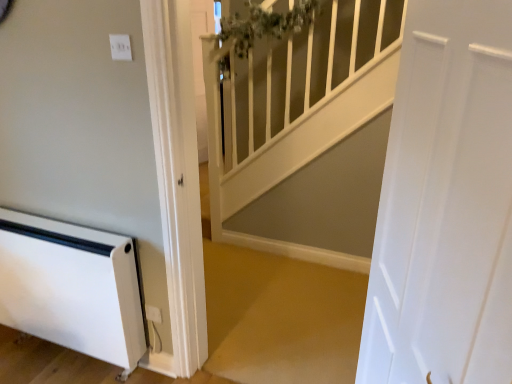
This screenshot has height=384, width=512. What do you see at coordinates (445, 204) in the screenshot? I see `white smooth door at right` at bounding box center [445, 204].

Image resolution: width=512 pixels, height=384 pixels. I want to click on white smooth door at right, so click(x=445, y=204).

The image size is (512, 384). What do you see at coordinates (153, 314) in the screenshot? I see `white plastic electric outlet at lower center` at bounding box center [153, 314].

What are the coordinates of `white smooth door at right` in the screenshot? It's located at (445, 204).

Does point (301, 241) come behind point (398, 350)?

That is True.

What's the angular difference between white glossy banister at upper center and white smooth door at right's facing directions?

The angle between the facing direction of white glossy banister at upper center and the facing direction of white smooth door at right is 74.1 degrees.

Find the location of a particular element. The width and height of the screenshot is (512, 384). door to the right of white glossy banister at upper center is located at coordinates (445, 204).

Which is behind, white glossy banister at upper center or white smooth door at right?

white glossy banister at upper center is further away from the camera.

This screenshot has height=384, width=512. I want to click on stairwell located above the white smooth door at right (from the image's perspective), so pos(306,135).

Consider the image. What's the angular difference between white smooth door at right and white glossy banister at upper center's facing directions?

74.1 degrees.

Can you confirm if white smooth door at right is taller than white glossy banister at upper center?

In fact, white smooth door at right may be shorter than white glossy banister at upper center.

From the image's perspective, relative to white glossy banister at upper center, is white smooth door at right above or below?

Clearly, from the image's perspective, white smooth door at right is below white glossy banister at upper center.

Would you consider white plastic electric outlet at lower center to be distant from white smooth door at right?

Absolutely, white plastic electric outlet at lower center is distant from white smooth door at right.

Is white plastic electric outlet at lower center oriented towards white smooth door at right?

No.

Would you say white plastic electric outlet at lower center is inside or outside white smooth door at right?

white plastic electric outlet at lower center is outside white smooth door at right.

Where is `electric outlet that appears on the right of white plastic heater at lower left`? The width and height of the screenshot is (512, 384). electric outlet that appears on the right of white plastic heater at lower left is located at coordinates (153, 314).

In terms of size, does white plastic heater at lower left appear bigger or smaller than white plastic electric outlet at lower center?

Considering their sizes, white plastic heater at lower left takes up more space than white plastic electric outlet at lower center.

Would you say white plastic heater at lower left is outside white plastic electric outlet at lower center?

white plastic heater at lower left lies outside white plastic electric outlet at lower center's area.

From the image's perspective, which object appears higher, white plastic heater at lower left or white smooth door at right?

white smooth door at right.

Is white plastic heater at lower left shorter than white smooth door at right?

Indeed, white plastic heater at lower left has a lesser height compared to white smooth door at right.

Which object is positioned more to the right, white plastic heater at lower left or white smooth door at right?

Positioned to the right is white smooth door at right.

Which object is closer to the camera taking this photo, white plastic heater at lower left or white smooth door at right?

white smooth door at right is in front.

Is white smooth door at right positioned behind white plastic electric outlet at lower center?

No, it is not.

Considering the relative sizes of white smooth door at right and white plastic electric outlet at lower center in the image provided, is white smooth door at right smaller than white plastic electric outlet at lower center?

No, white smooth door at right is not smaller than white plastic electric outlet at lower center.

You are a GUI agent. You are given a task and a screenshot of the screen. Output one action in this format:
    pyautogui.click(x=<x>, y=<y>)
    Task: Click on the electric outlet on the left of the white smooth door at right
    
    Given the screenshot: What is the action you would take?
    pyautogui.click(x=153, y=314)

Is white smooth door at right facing away from white plastic heater at lower left?

No, white smooth door at right is not facing away from white plastic heater at lower left.

Does point (485, 64) appear closer or farther from the camera than point (82, 349)?

Clearly, point (485, 64) is closer to the camera than point (82, 349).

Between white smooth door at right and white plastic heater at lower left, which one has larger size?

white smooth door at right.

Are white smooth door at right and white plastic heater at lower left beside each other?

No, white smooth door at right is not next to white plastic heater at lower left.

Identify the location of door below the white glossy banister at upper center (from the image's perspective). Image resolution: width=512 pixels, height=384 pixels. (445, 204).

Locate an element on the screen. door above the white glossy banister at upper center (from a real-world perspective) is located at coordinates (445, 204).

From the image, which object appears to be farther from white smooth door at right, white glossy banister at upper center or white plastic heater at lower left?

Among the two, white glossy banister at upper center is located further to white smooth door at right.

Looking at the image, which one is located further to white smooth door at right, white plastic electric outlet at lower center or white glossy banister at upper center?

Among the two, white glossy banister at upper center is located further to white smooth door at right.

Looking at this image, looking at the image, which one is located further to white plastic electric outlet at lower center, white plastic heater at lower left or white smooth door at right?

Among the two, white smooth door at right is located further to white plastic electric outlet at lower center.

Based on their spatial positions, is white plastic heater at lower left or white glossy banister at upper center further from white smooth door at right?

white glossy banister at upper center is positioned further to the anchor white smooth door at right.

Based on their spatial positions, is white plastic heater at lower left or white plastic electric outlet at lower center further from white smooth door at right?

Among the two, white plastic electric outlet at lower center is located further to white smooth door at right.

Based on their spatial positions, is white plastic electric outlet at lower center or white glossy banister at upper center further from white plastic heater at lower left?

white glossy banister at upper center lies further to white plastic heater at lower left than the other object.

Which object lies further to the anchor point white glossy banister at upper center, white plastic electric outlet at lower center or white plastic heater at lower left?

white plastic electric outlet at lower center.

Based on their spatial positions, is white glossy banister at upper center or white plastic electric outlet at lower center closer to white smooth door at right?

white plastic electric outlet at lower center is positioned closer to the anchor white smooth door at right.

At what (x,y) coordinates should I click in order to perform the action: click on stairwell between white plastic heater at lower left and white smooth door at right. Please return your answer as a coordinate pair (x, y). Looking at the image, I should click on (306, 135).

Locate an element on the screen. The image size is (512, 384). stairwell located between white smooth door at right and white plastic electric outlet at lower center in the depth direction is located at coordinates (306, 135).

Locate an element on the screen. appliance located between white smooth door at right and white plastic electric outlet at lower center in the depth direction is located at coordinates (72, 287).

The width and height of the screenshot is (512, 384). I want to click on electric outlet located between white plastic heater at lower left and white glossy banister at upper center in the left-right direction, so pyautogui.click(x=153, y=314).